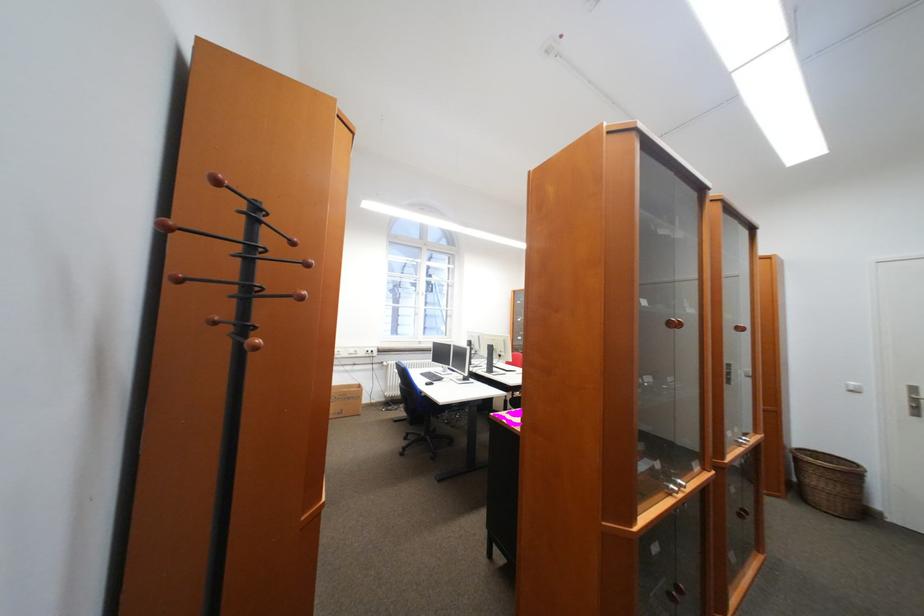
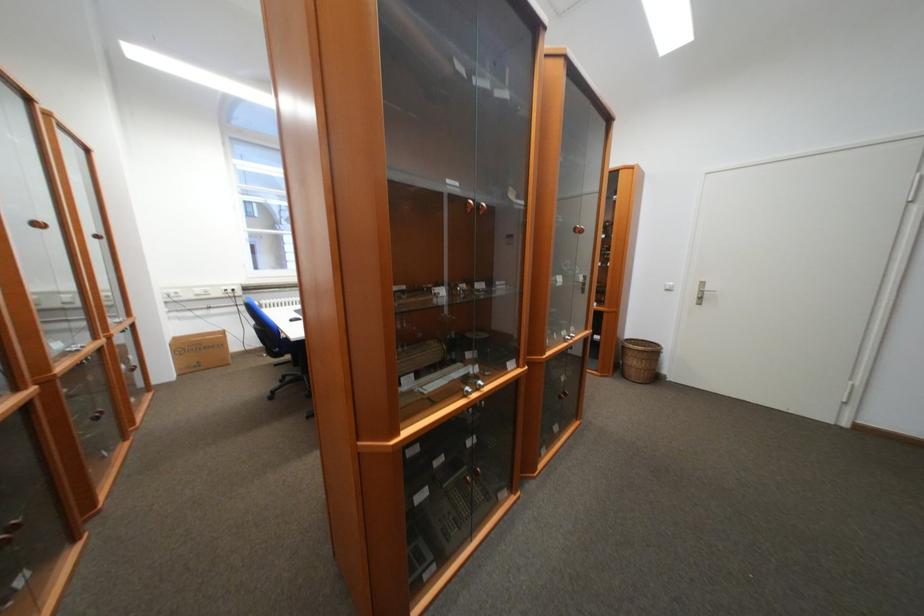
Question: Which direction would the cameraman need to move to produce the second image? Reply with the corresponding letter.

Choices:
 (A) Left
 (B) Right
 (C) Forward
 (D) Backward

Answer: (B)